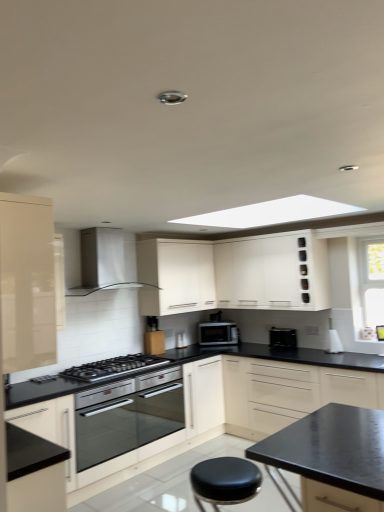
Locate an element on the screen. Image resolution: width=384 pixels, height=512 pixels. empty space that is ontop of black matte toaster at lower center (from a real-world perspective) is located at coordinates (290, 327).